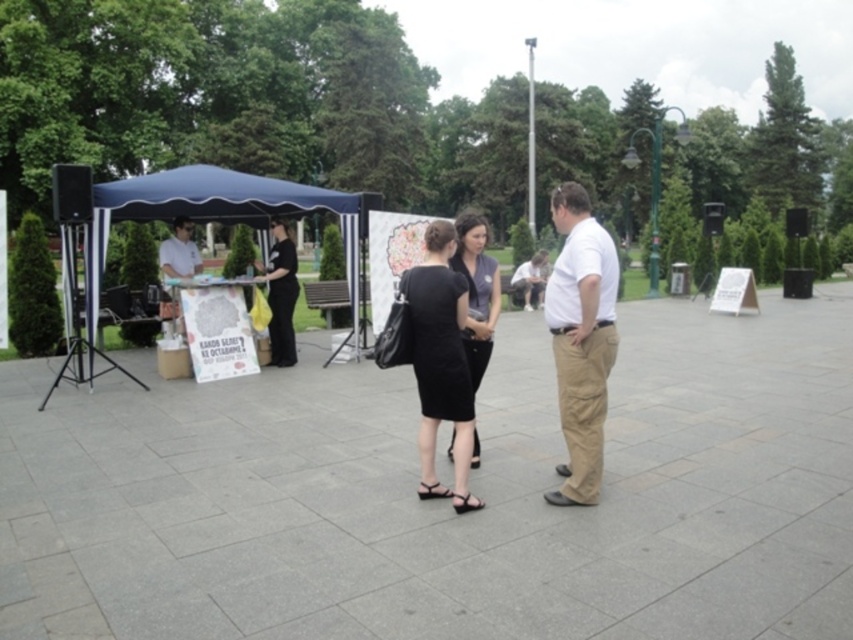
You are a photographer standing at the edge of the park. You want to take a photo that includes both the white cotton shirt at center and the black fabric umbrella at upper center. Which object should you focus on first to ensure both are in sharp focus?

You should focus on the white cotton shirt at center first because it is closer to the viewer than the black fabric umbrella at upper center. By focusing on the closer object, the depth of field may still keep the farther object in acceptable focus.

You are a photographer standing at the edge of the paved area. You want to take a photo of the white cotton shirt at center and the black fabric umbrella at upper center such that both are in focus. The camera you are using has a depth of field that can cover objects within a 4 meter range. Will both subjects be in focus?

The white cotton shirt at center is 3.78 meters from the black fabric umbrella at upper center. Since the distance between them is within the 4 meter range of the camera, both subjects will be in focus.

You are standing at the origin point in the park. There is a white cotton shirt at center represented by point (x=581, y=339). If you walk straight ahead, will you reach the white cotton shirt at center before walking 10 meters?

The point (x=581, y=339) represents the location of the white cotton shirt at center. Since the coordinate system isn not provided, we cannot determine the distance from the origin to the shirt. Therefore, it is impossible to determine if walking straight ahead for 10 meters would reach it before that distance.